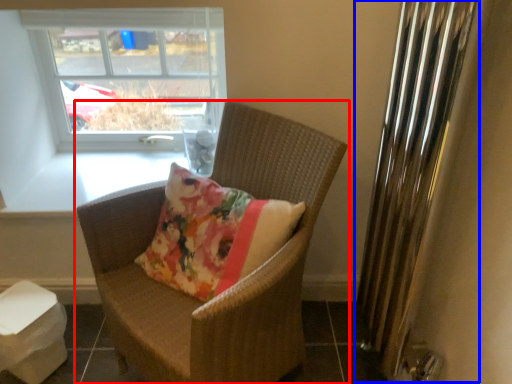
Question: Which of the following is the farthest to the observer, chair (highlighted by a red box) or radiator (highlighted by a blue box)?

Choices:
 (A) chair
 (B) radiator

Answer: (A)